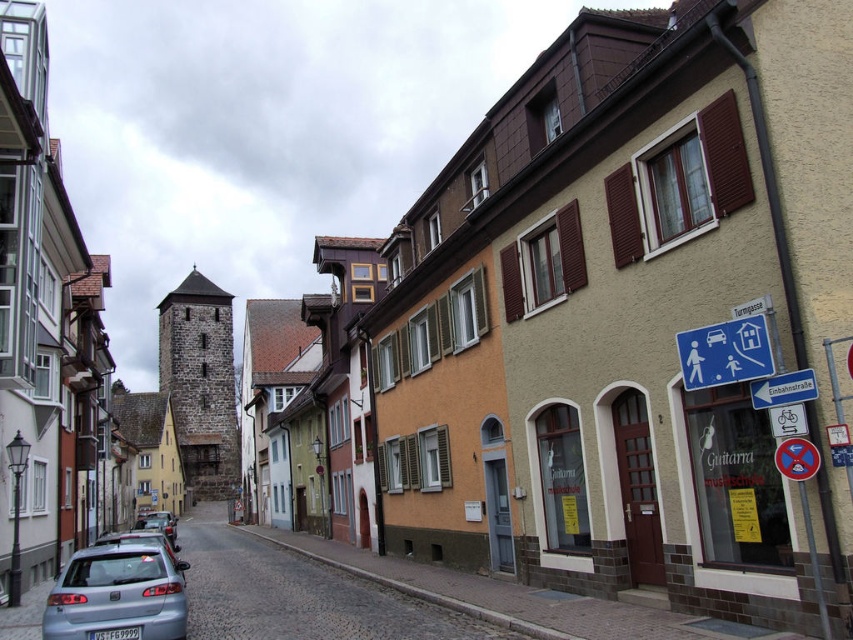
Does metallic silver hatchback at lower left come behind blue plastic sign at center right?

Yes.

Does point (106, 554) come behind point (801, 378)?

Yes, point (106, 554) is farther from viewer.

The image size is (853, 640). I want to click on metallic silver hatchback at lower left, so click(x=119, y=595).

Which is more to the left, metallic silver hatchback at lower left or silver metallic car at lower left?

silver metallic car at lower left is more to the left.

Which is below, metallic silver hatchback at lower left or silver metallic car at lower left?

silver metallic car at lower left

Is point (105, 628) more distant than point (142, 536)?

No.

Identify the location of metallic silver hatchback at lower left. The height and width of the screenshot is (640, 853). (119, 595).

Between point (175, 616) and point (138, 524), which one is positioned behind?

Positioned behind is point (138, 524).

Can you confirm if metallic silver hatchback at lower left is positioned below silver metallic car at center?

No, metallic silver hatchback at lower left is not below silver metallic car at center.

You are a GUI agent. You are given a task and a screenshot of the screen. Output one action in this format:
    pyautogui.click(x=<x>, y=<y>)
    Task: Click on the metallic silver hatchback at lower left
    
    Given the screenshot: What is the action you would take?
    pyautogui.click(x=119, y=595)